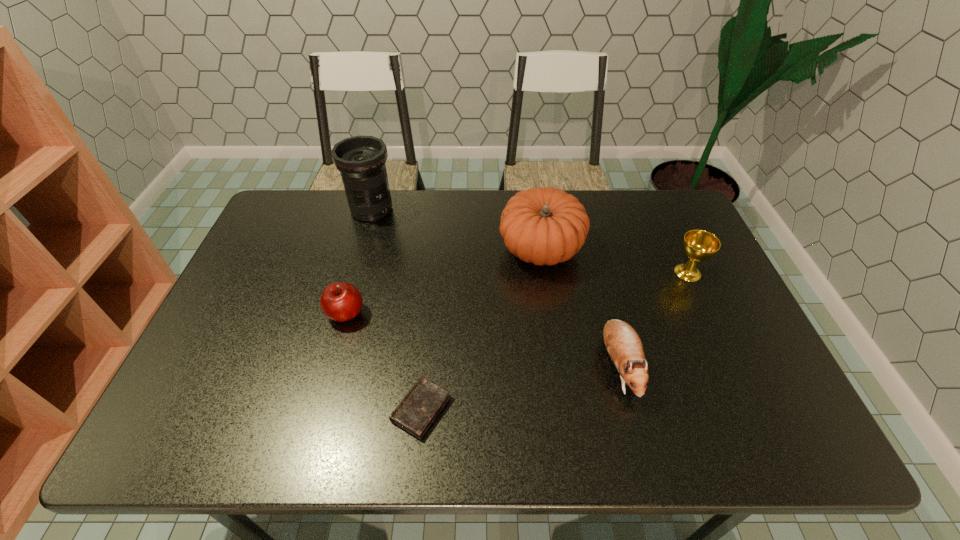
This screenshot has width=960, height=540. What are the coordinates of `the tallest object` in the screenshot? It's located at (361, 160).

At what (x,y) coordinates should I click in order to perform the action: click on pumpkin. Please return your answer as a coordinate pair (x, y). This screenshot has height=540, width=960. Looking at the image, I should click on (545, 226).

Where is `the rightmost object`? This screenshot has width=960, height=540. the rightmost object is located at coordinates (698, 245).

The image size is (960, 540). Find the location of `the fourth farthest object`. the fourth farthest object is located at coordinates (340, 301).

The image size is (960, 540). Identify the location of hamster. (622, 342).

This screenshot has width=960, height=540. Identify the location of the third object from left to right. (418, 409).

This screenshot has height=540, width=960. Identify the location of diary. (418, 409).

You are a GUI agent. You are given a task and a screenshot of the screen. Output one action in this format:
    pyautogui.click(x=<x>, y=<y>)
    Task: Click on the vacant space located 0.400m on the front of the tallest object
    
    Given the screenshot: What is the action you would take?
    pyautogui.click(x=341, y=321)

Locate an element on the screen. Image resolution: width=960 pixels, height=540 pixels. free space located on the left of the pumpkin is located at coordinates (415, 248).

Where is `vacant point located 0.310m on the front of the chalice`? This screenshot has height=540, width=960. vacant point located 0.310m on the front of the chalice is located at coordinates (736, 379).